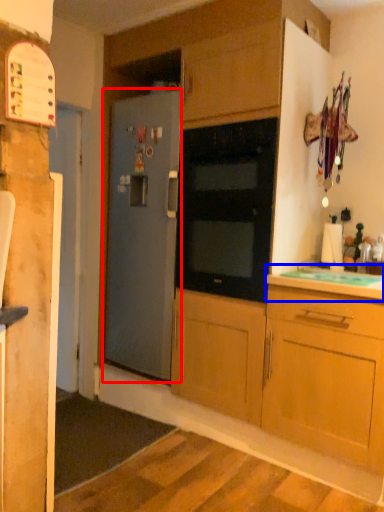
Question: Among these objects, which one is farthest to the camera, refrigerator (highlighted by a red box) or countertop (highlighted by a blue box)?

Choices:
 (A) refrigerator
 (B) countertop

Answer: (A)